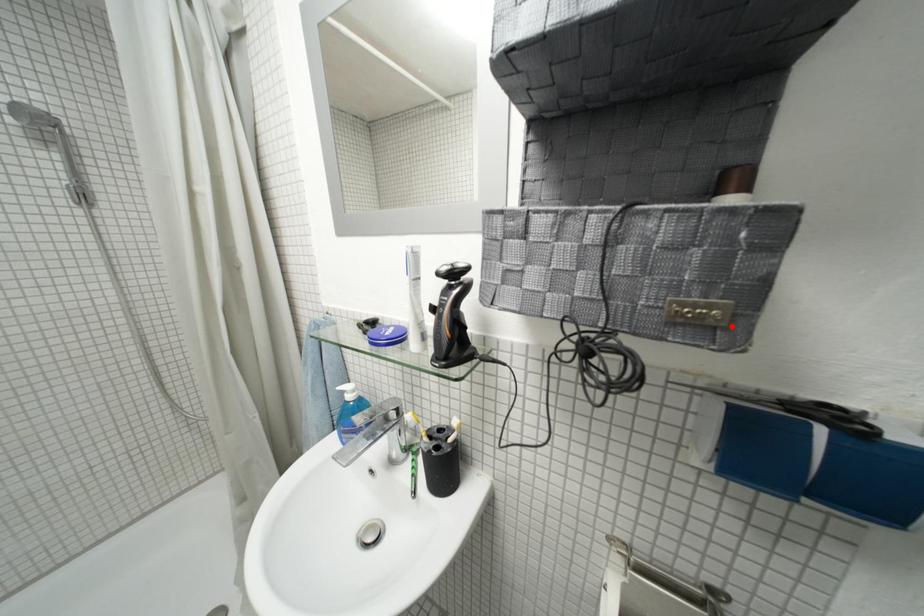
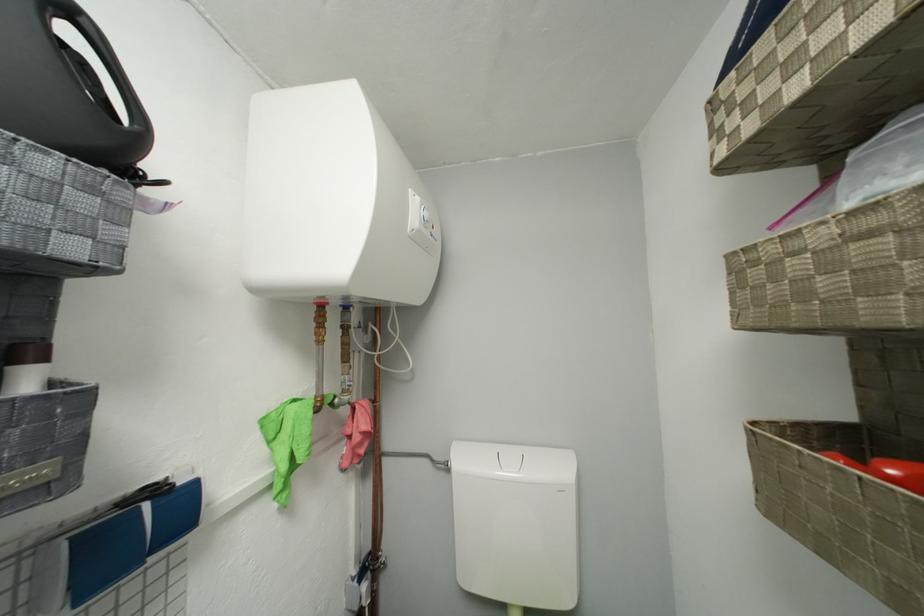
Locate, in the second image, the point that corresponds to the highlighted location in the first image.

(66, 477)